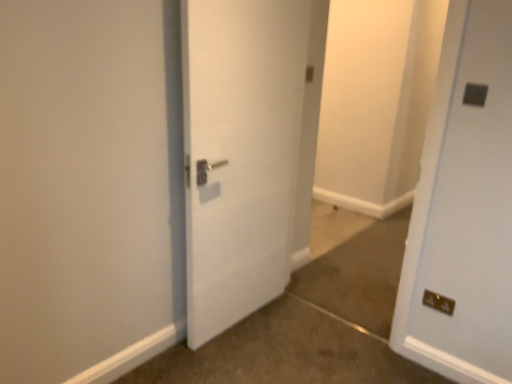
Locate an element on the screen. The width and height of the screenshot is (512, 384). vacant location below white matte door at center (from a real-world perspective) is located at coordinates (236, 319).